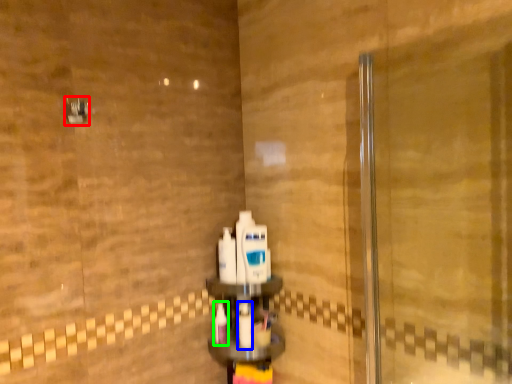
Question: Which object is positioned closest to shower (highlighted by a red box)? Select from mouthwash (highlighted by a blue box) and toothbrush (highlighted by a green box).

Choices:
 (A) mouthwash
 (B) toothbrush

Answer: (B)